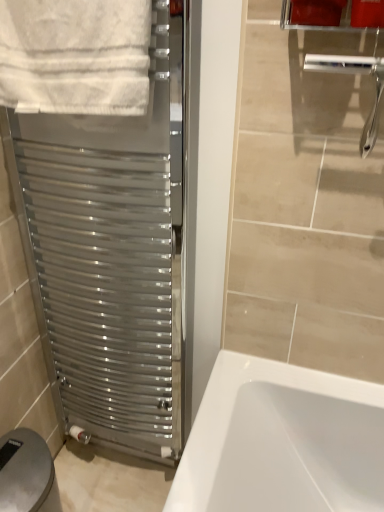
Question: From a real-world perspective, is matte plastic toilet paper holder at lower left physically located above or below satin metallic towel warmer at left?

Choices:
 (A) above
 (B) below

Answer: (B)

Question: Looking at their shapes, would you say matte plastic toilet paper holder at lower left is wider or thinner than satin metallic towel warmer at left?

Choices:
 (A) wide
 (B) thin

Answer: (A)

Question: Which object is positioned farthest from the white cotton towel at upper left?

Choices:
 (A) matte plastic toilet paper holder at lower left
 (B) satin metallic towel warmer at left

Answer: (A)

Question: Considering the real-world distances, which object is farthest from the matte plastic toilet paper holder at lower left?

Choices:
 (A) satin metallic towel warmer at left
 (B) white cotton towel at upper left

Answer: (B)